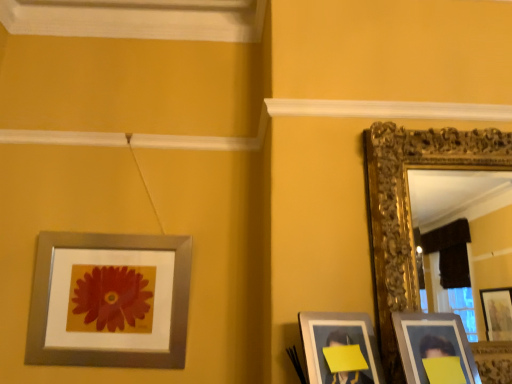
How much space does matte silver picture frame at lower right, which ranks as the third picture frame in left-to-right order, occupy horizontally?

matte silver picture frame at lower right, which ranks as the third picture frame in left-to-right order, is 2.80 inches wide.

What are the coordinates of `matte silver picture frame at lower right, the 2th picture frame viewed from the left` in the screenshot? It's located at (339, 345).

Describe the element at coordinates (409, 208) in the screenshot. Image resolution: width=512 pixels, height=384 pixels. I see `gold ornate mirror at right, placed as the first picture frame when sorted from right to left` at that location.

Locate an element on the screen. gold ornate mirror at right, placed as the first picture frame when sorted from right to left is located at coordinates (409, 208).

What is the approximate height of silver metallic picture frame at upper left, which is the first picture frame in left-to-right order?

It is 22.83 inches.

Where is `matte silver picture frame at lower right, which ranks as the third picture frame in left-to-right order`? matte silver picture frame at lower right, which ranks as the third picture frame in left-to-right order is located at coordinates (432, 343).

From the image's perspective, is matte silver picture frame at lower right, the second picture frame when ordered from right to left, below matte silver picture frame at lower right, which is the third picture frame in right-to-left order?

No, from the image's perspective, matte silver picture frame at lower right, the second picture frame when ordered from right to left, is not below matte silver picture frame at lower right, which is the third picture frame in right-to-left order.

Is matte silver picture frame at lower right, which ranks as the third picture frame in left-to-right order, oriented towards matte silver picture frame at lower right, the 2th picture frame viewed from the left?

No, matte silver picture frame at lower right, which ranks as the third picture frame in left-to-right order, does not turn towards matte silver picture frame at lower right, the 2th picture frame viewed from the left.

From a real-world perspective, is matte silver picture frame at lower right, the second picture frame when ordered from right to left, positioned under matte silver picture frame at lower right, the 2th picture frame viewed from the left, based on gravity?

Incorrect, from a real-world perspective, matte silver picture frame at lower right, the second picture frame when ordered from right to left, is higher than matte silver picture frame at lower right, the 2th picture frame viewed from the left.

Considering the relative positions of matte silver picture frame at lower right, which ranks as the third picture frame in left-to-right order, and matte silver picture frame at lower right, which is the third picture frame in right-to-left order, in the image provided, is matte silver picture frame at lower right, which ranks as the third picture frame in left-to-right order, to the right of matte silver picture frame at lower right, which is the third picture frame in right-to-left order, from the viewer's perspective?

Yes.

Considering the relative sizes of matte silver picture frame at lower right, which ranks as the third picture frame in left-to-right order, and silver metallic picture frame at upper left, which is the first picture frame in left-to-right order, in the image provided, is matte silver picture frame at lower right, which ranks as the third picture frame in left-to-right order, wider than silver metallic picture frame at upper left, which is the first picture frame in left-to-right order,?

No, matte silver picture frame at lower right, which ranks as the third picture frame in left-to-right order, is not wider than silver metallic picture frame at upper left, which is the first picture frame in left-to-right order.

Would you say matte silver picture frame at lower right, which ranks as the third picture frame in left-to-right order, is to the left or to the right of silver metallic picture frame at upper left, which is the first picture frame in left-to-right order, in the picture?

matte silver picture frame at lower right, which ranks as the third picture frame in left-to-right order, is positioned on silver metallic picture frame at upper left, which is the first picture frame in left-to-right order,'s right side.

In the scene shown: From a real-world perspective, is matte silver picture frame at lower right, which ranks as the third picture frame in left-to-right order, physically above silver metallic picture frame at upper left, which is the first picture frame in left-to-right order?

No, from a real-world perspective, matte silver picture frame at lower right, which ranks as the third picture frame in left-to-right order, is not above silver metallic picture frame at upper left, which is the first picture frame in left-to-right order.

Considering the positions of objects silver metallic picture frame at upper left, which is the first picture frame in left-to-right order, and matte silver picture frame at lower right, the second picture frame when ordered from right to left, in the image provided, who is in front, silver metallic picture frame at upper left, which is the first picture frame in left-to-right order, or matte silver picture frame at lower right, the second picture frame when ordered from right to left,?

matte silver picture frame at lower right, the second picture frame when ordered from right to left, is in front.

Are silver metallic picture frame at upper left, which is the first picture frame in left-to-right order, and matte silver picture frame at lower right, the second picture frame when ordered from right to left, far apart?

Yes.

At what (x,y) coordinates should I click in order to perform the action: click on picture frame that is the 1st object directly below the silver metallic picture frame at upper left, the fourth picture frame viewed from the right (from a real-world perspective). Please return your answer as a coordinate pair (x, y). This screenshot has height=384, width=512. Looking at the image, I should click on (432, 343).

Is point (39, 290) positioned after point (421, 325)?

Yes, point (39, 290) is behind point (421, 325).

Is point (438, 343) closer or farther from the camera than point (371, 126)?

Point (438, 343) appears to be closer to the viewer than point (371, 126).

Is matte silver picture frame at lower right, which ranks as the third picture frame in left-to-right order, further to the viewer compared to gold ornate mirror at right, placed as the first picture frame when sorted from right to left?

That is False.

Is matte silver picture frame at lower right, which ranks as the third picture frame in left-to-right order, facing away from gold ornate mirror at right, the 4th picture frame viewed from the left?

Yes.

Considering the positions of objects matte silver picture frame at lower right, the second picture frame when ordered from right to left, and gold ornate mirror at right, the 4th picture frame viewed from the left, in the image provided, who is more to the left, matte silver picture frame at lower right, the second picture frame when ordered from right to left, or gold ornate mirror at right, the 4th picture frame viewed from the left,?

matte silver picture frame at lower right, the second picture frame when ordered from right to left.

Where is `picture frame lying above the silver metallic picture frame at upper left, the fourth picture frame viewed from the right (from the image's perspective)`? picture frame lying above the silver metallic picture frame at upper left, the fourth picture frame viewed from the right (from the image's perspective) is located at coordinates (409, 208).

Is gold ornate mirror at right, the 4th picture frame viewed from the left, inside or outside of silver metallic picture frame at upper left, which is the first picture frame in left-to-right order?

gold ornate mirror at right, the 4th picture frame viewed from the left, is not inside silver metallic picture frame at upper left, which is the first picture frame in left-to-right order, it's outside.

Considering the relative positions of gold ornate mirror at right, placed as the first picture frame when sorted from right to left, and silver metallic picture frame at upper left, which is the first picture frame in left-to-right order, in the image provided, is gold ornate mirror at right, placed as the first picture frame when sorted from right to left, to the right of silver metallic picture frame at upper left, which is the first picture frame in left-to-right order, from the viewer's perspective?

Yes.

Which of these two, gold ornate mirror at right, the 4th picture frame viewed from the left, or silver metallic picture frame at upper left, which is the first picture frame in left-to-right order, is thinner?

silver metallic picture frame at upper left, which is the first picture frame in left-to-right order.

Does silver metallic picture frame at upper left, which is the first picture frame in left-to-right order, have a larger size compared to gold ornate mirror at right, placed as the first picture frame when sorted from right to left?

No, silver metallic picture frame at upper left, which is the first picture frame in left-to-right order, is not bigger than gold ornate mirror at right, placed as the first picture frame when sorted from right to left.

From the image's perspective, relative to gold ornate mirror at right, the 4th picture frame viewed from the left, is silver metallic picture frame at upper left, the fourth picture frame viewed from the right, above or below?

silver metallic picture frame at upper left, the fourth picture frame viewed from the right, is below gold ornate mirror at right, the 4th picture frame viewed from the left.

Is silver metallic picture frame at upper left, which is the first picture frame in left-to-right order, oriented away from gold ornate mirror at right, placed as the first picture frame when sorted from right to left?

No.

Is silver metallic picture frame at upper left, which is the first picture frame in left-to-right order, taller than gold ornate mirror at right, the 4th picture frame viewed from the left?

In fact, silver metallic picture frame at upper left, which is the first picture frame in left-to-right order, may be shorter than gold ornate mirror at right, the 4th picture frame viewed from the left.

Considering the relative sizes of gold ornate mirror at right, the 4th picture frame viewed from the left, and matte silver picture frame at lower right, the 2th picture frame viewed from the left, in the image provided, is gold ornate mirror at right, the 4th picture frame viewed from the left, taller than matte silver picture frame at lower right, the 2th picture frame viewed from the left,?

Indeed, gold ornate mirror at right, the 4th picture frame viewed from the left, has a greater height compared to matte silver picture frame at lower right, the 2th picture frame viewed from the left.

Does gold ornate mirror at right, placed as the first picture frame when sorted from right to left, have a greater width compared to matte silver picture frame at lower right, which is the third picture frame in right-to-left order?

Indeed, gold ornate mirror at right, placed as the first picture frame when sorted from right to left, has a greater width compared to matte silver picture frame at lower right, which is the third picture frame in right-to-left order.

How different are the orientations of gold ornate mirror at right, placed as the first picture frame when sorted from right to left, and matte silver picture frame at lower right, the 2th picture frame viewed from the left, in degrees?

The facing directions of gold ornate mirror at right, placed as the first picture frame when sorted from right to left, and matte silver picture frame at lower right, the 2th picture frame viewed from the left, are 18.5 degrees apart.

From a real-world perspective, is gold ornate mirror at right, placed as the first picture frame when sorted from right to left, below matte silver picture frame at lower right, the 2th picture frame viewed from the left?

Actually, gold ornate mirror at right, placed as the first picture frame when sorted from right to left, is physically above matte silver picture frame at lower right, the 2th picture frame viewed from the left, in the real world.

Locate an element on the screen. This screenshot has width=512, height=384. the 1st picture frame to the left of the matte silver picture frame at lower right, which ranks as the third picture frame in left-to-right order, starting your count from the anchor is located at coordinates (339, 345).

From the image's perspective, count 1st picture frames downward from the silver metallic picture frame at upper left, the fourth picture frame viewed from the right, and point to it. Please provide its 2D coordinates.

[(432, 343)]

When comparing their distances from matte silver picture frame at lower right, which is the third picture frame in right-to-left order, does silver metallic picture frame at upper left, the fourth picture frame viewed from the right, or matte silver picture frame at lower right, the second picture frame when ordered from right to left, seem closer?

Based on the image, matte silver picture frame at lower right, the second picture frame when ordered from right to left, appears to be nearer to matte silver picture frame at lower right, which is the third picture frame in right-to-left order.

When comparing their distances from matte silver picture frame at lower right, the second picture frame when ordered from right to left, does matte silver picture frame at lower right, the 2th picture frame viewed from the left, or gold ornate mirror at right, placed as the first picture frame when sorted from right to left, seem closer?

matte silver picture frame at lower right, the 2th picture frame viewed from the left, is closer to matte silver picture frame at lower right, the second picture frame when ordered from right to left.

Estimate the real-world distances between objects in this image. Which object is closer to gold ornate mirror at right, placed as the first picture frame when sorted from right to left, matte silver picture frame at lower right, the 2th picture frame viewed from the left, or silver metallic picture frame at upper left, which is the first picture frame in left-to-right order?

The object closer to gold ornate mirror at right, placed as the first picture frame when sorted from right to left, is matte silver picture frame at lower right, the 2th picture frame viewed from the left.

Estimate the real-world distances between objects in this image. Which object is closer to matte silver picture frame at lower right, the second picture frame when ordered from right to left, silver metallic picture frame at upper left, which is the first picture frame in left-to-right order, or matte silver picture frame at lower right, which is the third picture frame in right-to-left order?

matte silver picture frame at lower right, which is the third picture frame in right-to-left order.

When comparing their distances from silver metallic picture frame at upper left, which is the first picture frame in left-to-right order, does matte silver picture frame at lower right, the 2th picture frame viewed from the left, or gold ornate mirror at right, the 4th picture frame viewed from the left, seem further?

Among the two, gold ornate mirror at right, the 4th picture frame viewed from the left, is located further to silver metallic picture frame at upper left, which is the first picture frame in left-to-right order.

Based on their spatial positions, is matte silver picture frame at lower right, which ranks as the third picture frame in left-to-right order, or matte silver picture frame at lower right, the 2th picture frame viewed from the left, closer to gold ornate mirror at right, placed as the first picture frame when sorted from right to left?

matte silver picture frame at lower right, which ranks as the third picture frame in left-to-right order, is positioned closer to the anchor gold ornate mirror at right, placed as the first picture frame when sorted from right to left.

Estimate the real-world distances between objects in this image. Which object is closer to matte silver picture frame at lower right, the second picture frame when ordered from right to left, gold ornate mirror at right, placed as the first picture frame when sorted from right to left, or silver metallic picture frame at upper left, which is the first picture frame in left-to-right order?

gold ornate mirror at right, placed as the first picture frame when sorted from right to left, is closer to matte silver picture frame at lower right, the second picture frame when ordered from right to left.

Looking at the image, which one is located further to silver metallic picture frame at upper left, the fourth picture frame viewed from the right, gold ornate mirror at right, the 4th picture frame viewed from the left, or matte silver picture frame at lower right, which ranks as the third picture frame in left-to-right order?

matte silver picture frame at lower right, which ranks as the third picture frame in left-to-right order, lies further to silver metallic picture frame at upper left, the fourth picture frame viewed from the right, than the other object.

I want to click on picture frame located between matte silver picture frame at lower right, which is the third picture frame in right-to-left order, and gold ornate mirror at right, placed as the first picture frame when sorted from right to left, in the left-right direction, so click(432, 343).

I want to click on picture frame situated between silver metallic picture frame at upper left, the fourth picture frame viewed from the right, and matte silver picture frame at lower right, which ranks as the third picture frame in left-to-right order, from left to right, so click(339, 345).